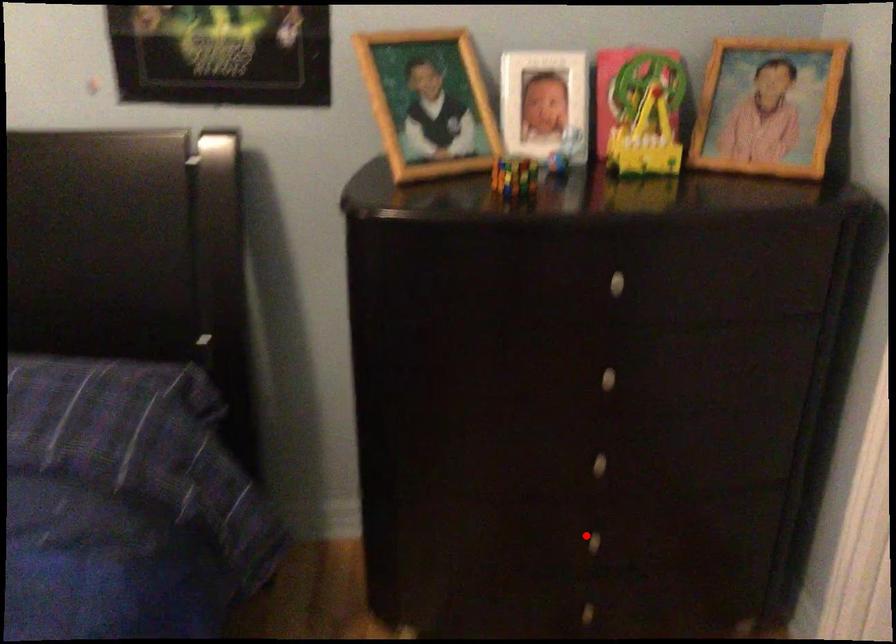
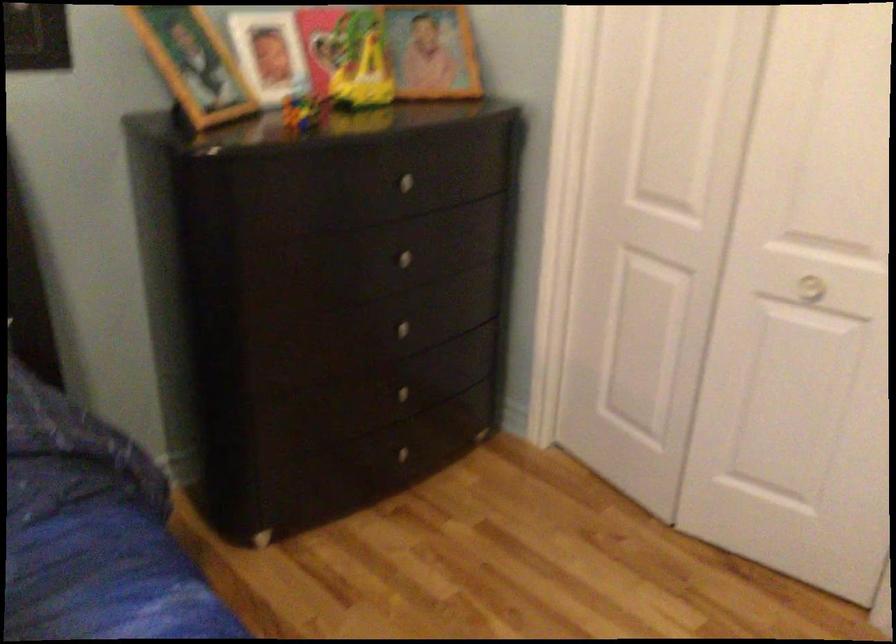
Find the pixel in the second image that matches the highlighted location in the first image.

(400, 393)